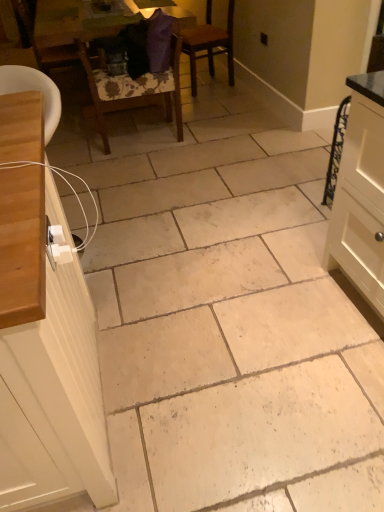
Where is `free region under brown wooden chair at center, arranged as the first chair when viewed from the right (from a real-world perspective)`? The width and height of the screenshot is (384, 512). free region under brown wooden chair at center, arranged as the first chair when viewed from the right (from a real-world perspective) is located at coordinates (208, 86).